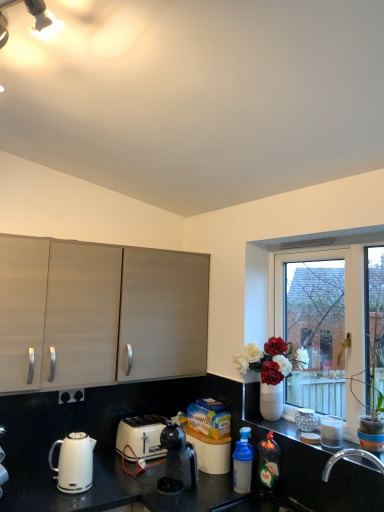
Question: From the image's perspective, does translucent plastic bottle at lower right, the second bottle viewed from the left, appear higher than white glossy kettle at lower left?

Choices:
 (A) yes
 (B) no

Answer: (B)

Question: Is translucent plastic bottle at lower right, the second bottle viewed from the left, bigger than white glossy kettle at lower left?

Choices:
 (A) no
 (B) yes

Answer: (A)

Question: Is translucent plastic bottle at lower right, the second bottle viewed from the left, in contact with white glossy kettle at lower left?

Choices:
 (A) no
 (B) yes

Answer: (A)

Question: Considering the relative positions of translucent plastic bottle at lower right, placed as the 1th bottle when sorted from right to left, and white glossy kettle at lower left in the image provided, is translucent plastic bottle at lower right, placed as the 1th bottle when sorted from right to left, to the right of white glossy kettle at lower left from the viewer's perspective?

Choices:
 (A) yes
 (B) no

Answer: (A)

Question: Is translucent plastic bottle at lower right, placed as the 1th bottle when sorted from right to left, shorter than white glossy kettle at lower left?

Choices:
 (A) no
 (B) yes

Answer: (A)

Question: Is translucent plastic bottle at lower right, the 1th bottle from the left, situated inside matte wood cabinets at left or outside?

Choices:
 (A) inside
 (B) outside

Answer: (B)

Question: Would you say translucent plastic bottle at lower right, which is counted as the second bottle, starting from the right, is to the left or to the right of matte wood cabinets at left in the picture?

Choices:
 (A) right
 (B) left

Answer: (A)

Question: Considering the positions of point (238, 441) and point (16, 387), is point (238, 441) closer or farther from the camera than point (16, 387)?

Choices:
 (A) farther
 (B) closer

Answer: (A)

Question: Relative to matte wood cabinets at left, is translucent plastic bottle at lower right, the 1th bottle from the left, in front or behind?

Choices:
 (A) front
 (B) behind

Answer: (B)

Question: Is translucent plastic bottle at lower right, which is counted as the second bottle, starting from the right, to the left or to the right of translucent glass vase at lower right in the image?

Choices:
 (A) right
 (B) left

Answer: (B)

Question: In terms of width, does translucent plastic bottle at lower right, which is counted as the second bottle, starting from the right, look wider or thinner when compared to translucent glass vase at lower right?

Choices:
 (A) wide
 (B) thin

Answer: (B)

Question: In the image, is translucent plastic bottle at lower right, which is counted as the second bottle, starting from the right, positioned in front of or behind translucent glass vase at lower right?

Choices:
 (A) front
 (B) behind

Answer: (B)

Question: From a real-world perspective, is translucent plastic bottle at lower right, which is counted as the second bottle, starting from the right, above or below translucent glass vase at lower right?

Choices:
 (A) below
 (B) above

Answer: (A)

Question: From a real-world perspective, relative to white glossy jar at lower right, which is the second appliance in back-to-front order, is metallic silver canisters at right, marked as the 1th appliance in a back-to-front arrangement, vertically above or below?

Choices:
 (A) above
 (B) below

Answer: (B)

Question: Is metallic silver canisters at right, marked as the 2th appliance in a front-to-back arrangement, wider or thinner than white glossy jar at lower right, positioned as the first appliance in front-to-back order?

Choices:
 (A) wide
 (B) thin

Answer: (A)